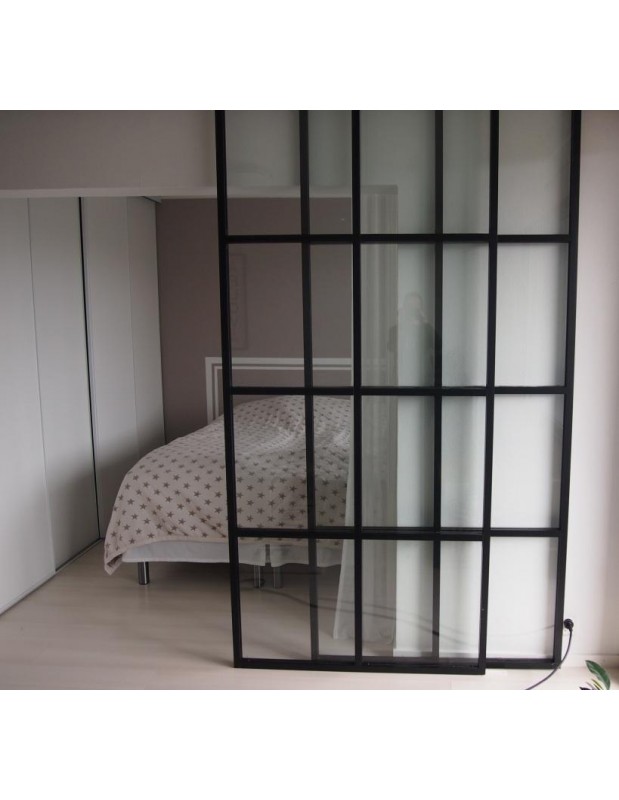
You are a GUI agent. You are given a task and a screenshot of the screen. Output one action in this format:
    pyautogui.click(x=<x>, y=<y>)
    Task: Click on the headboard outline
    Image resolution: width=619 pixels, height=800 pixels.
    Given the screenshot: What is the action you would take?
    (x=259, y=360)